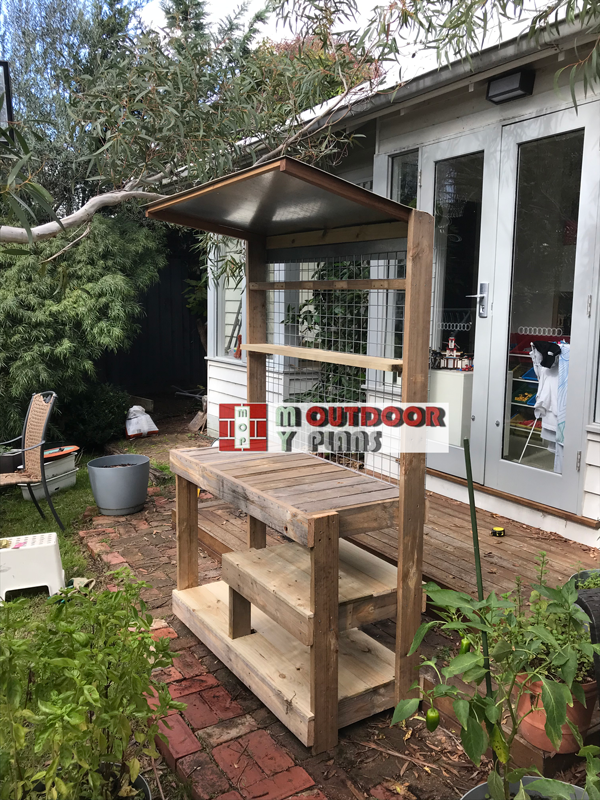
Locate an element on the screen. The width and height of the screenshot is (600, 800). chair is located at coordinates (34, 468).